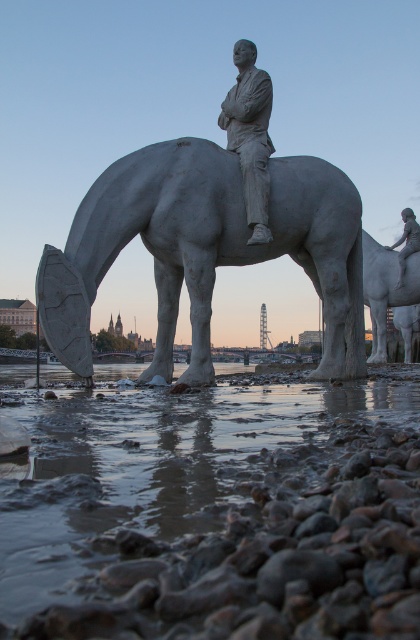
Can you confirm if matte gray statue at center is thinner than white glossy horse at center?

Yes.

This screenshot has height=640, width=420. Identify the location of matte gray statue at center. (251, 134).

Between white stone horse at center and matte gray statue at right, which one has less height?

matte gray statue at right is shorter.

Find the location of a particular element. white stone horse at center is located at coordinates (205, 248).

From the picture: Between white glossy horse at center and matte gray statue at right, which one appears on the right side from the viewer's perspective?

Positioned to the right is matte gray statue at right.

Is point (407, 266) less distant than point (404, 212)?

Yes, it is.

Which is behind, point (417, 285) or point (406, 230)?

The point (406, 230) is more distant.

You are a GUI agent. You are given a task and a screenshot of the screen. Output one action in this format:
    pyautogui.click(x=<x>, y=<y>)
    Task: Click on the white glossy horse at center
    This screenshot has height=640, width=420.
    Given the screenshot: What is the action you would take?
    pyautogui.click(x=385, y=289)